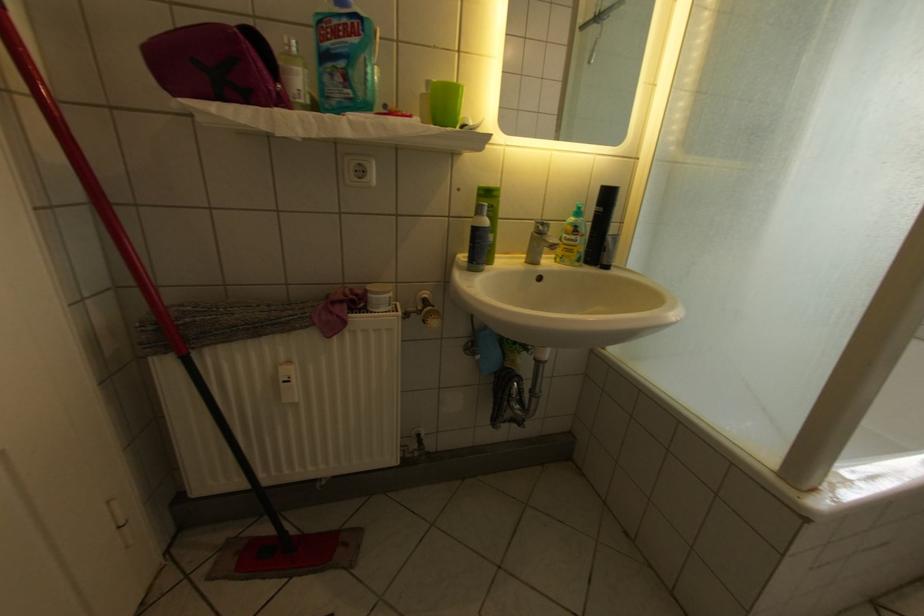
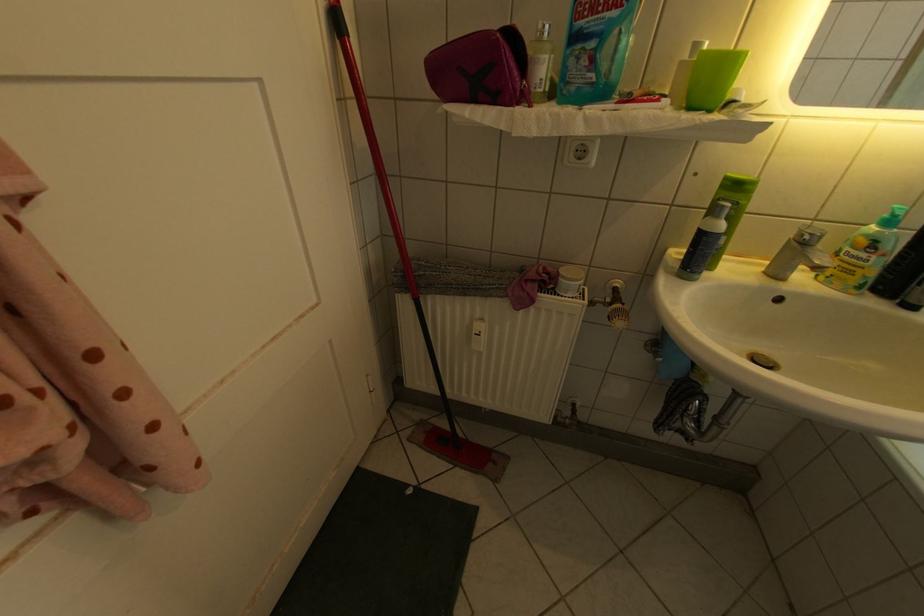
In the second image, find the point that corresponds to the point at 590,238 in the first image.

(888, 257)